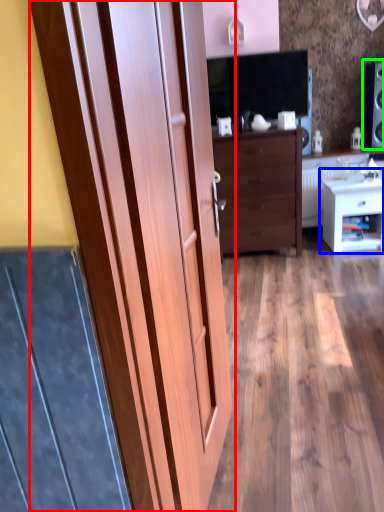
Question: Which object is positioned farthest from door (highlighted by a red box)? Select from nightstand (highlighted by a blue box) and speaker (highlighted by a green box).

Choices:
 (A) nightstand
 (B) speaker

Answer: (B)